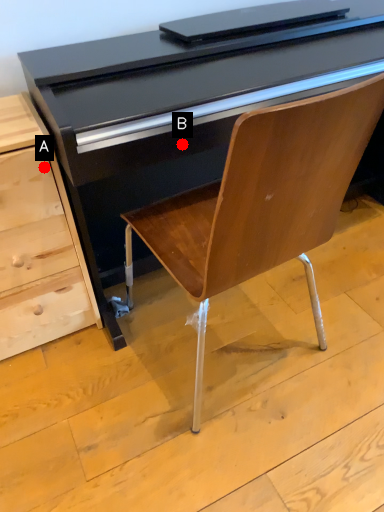
Question: Two points are circled on the image, labeled by A and B beside each circle. Which point is closer to the camera?

Choices:
 (A) A is closer
 (B) B is closer

Answer: (B)